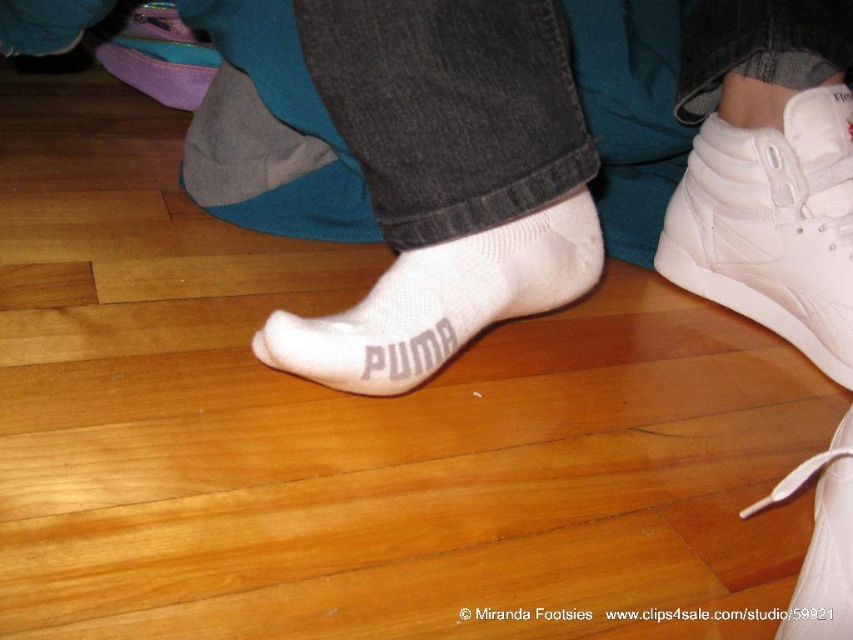
Question: Does white fabric socks at center have a greater width compared to white leather shoe at lower right?

Choices:
 (A) yes
 (B) no

Answer: (A)

Question: Does white fabric socks at center appear on the right side of white knit sock at center?

Choices:
 (A) no
 (B) yes

Answer: (A)

Question: Which object is closer to the camera taking this photo?

Choices:
 (A) white knit sock at center
 (B) white leather shoe at lower right

Answer: (B)

Question: Estimate the real-world distances between objects in this image. Which object is farther from the white fabric socks at center?

Choices:
 (A) white knit sock at center
 (B) white leather sneaker at right

Answer: (B)

Question: Observing the image, what is the correct spatial positioning of white leather sneaker at right in reference to white leather shoe at lower right?

Choices:
 (A) below
 (B) above

Answer: (B)

Question: Which of these objects is positioned closest to the white leather sneaker at right?

Choices:
 (A) white knit sock at center
 (B) white leather shoe at lower right

Answer: (A)